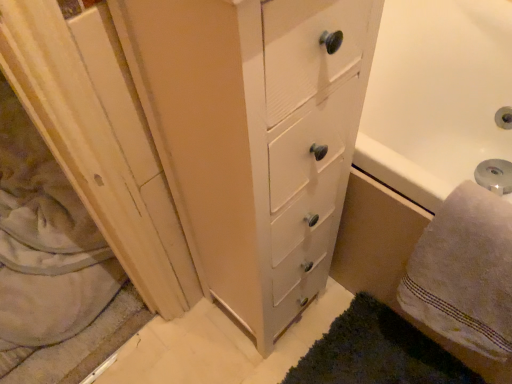
Question: Is dark green shaggy rug at lower right looking in the opposite direction of white fluffy towel at lower right?

Choices:
 (A) no
 (B) yes

Answer: (A)

Question: Does dark green shaggy rug at lower right have a lesser width compared to white fluffy towel at lower right?

Choices:
 (A) yes
 (B) no

Answer: (B)

Question: Is dark green shaggy rug at lower right with white fluffy towel at lower right?

Choices:
 (A) yes
 (B) no

Answer: (B)

Question: Is the depth of dark green shaggy rug at lower right less than that of white fluffy towel at lower right?

Choices:
 (A) no
 (B) yes

Answer: (A)

Question: Considering the relative sizes of dark green shaggy rug at lower right and white fluffy towel at lower right in the image provided, is dark green shaggy rug at lower right bigger than white fluffy towel at lower right?

Choices:
 (A) yes
 (B) no

Answer: (B)

Question: Is point (377, 370) positioned closer to the camera than point (472, 211)?

Choices:
 (A) farther
 (B) closer

Answer: (A)

Question: Considering the positions of dark green shaggy rug at lower right and white fluffy towel at lower right in the image, is dark green shaggy rug at lower right taller or shorter than white fluffy towel at lower right?

Choices:
 (A) short
 (B) tall

Answer: (A)

Question: In the image, is dark green shaggy rug at lower right positioned in front of or behind white fluffy towel at lower right?

Choices:
 (A) front
 (B) behind

Answer: (B)

Question: Which is correct: dark green shaggy rug at lower right is inside white fluffy towel at lower right, or outside of it?

Choices:
 (A) inside
 (B) outside

Answer: (B)

Question: Considering the positions of white fluffy towel at lower right and wooden screen door at left in the image, is white fluffy towel at lower right wider or thinner than wooden screen door at left?

Choices:
 (A) wide
 (B) thin

Answer: (B)

Question: Is point (452, 261) positioned closer to the camera than point (83, 87)?

Choices:
 (A) closer
 (B) farther

Answer: (B)

Question: Visually, is white fluffy towel at lower right positioned to the left or to the right of wooden screen door at left?

Choices:
 (A) right
 (B) left

Answer: (A)

Question: In terms of height, does white fluffy towel at lower right look taller or shorter compared to wooden screen door at left?

Choices:
 (A) tall
 (B) short

Answer: (A)

Question: Would you say wooden screen door at left is to the left or to the right of dark green shaggy rug at lower right in the picture?

Choices:
 (A) right
 (B) left

Answer: (B)

Question: In terms of size, does wooden screen door at left appear bigger or smaller than dark green shaggy rug at lower right?

Choices:
 (A) small
 (B) big

Answer: (B)